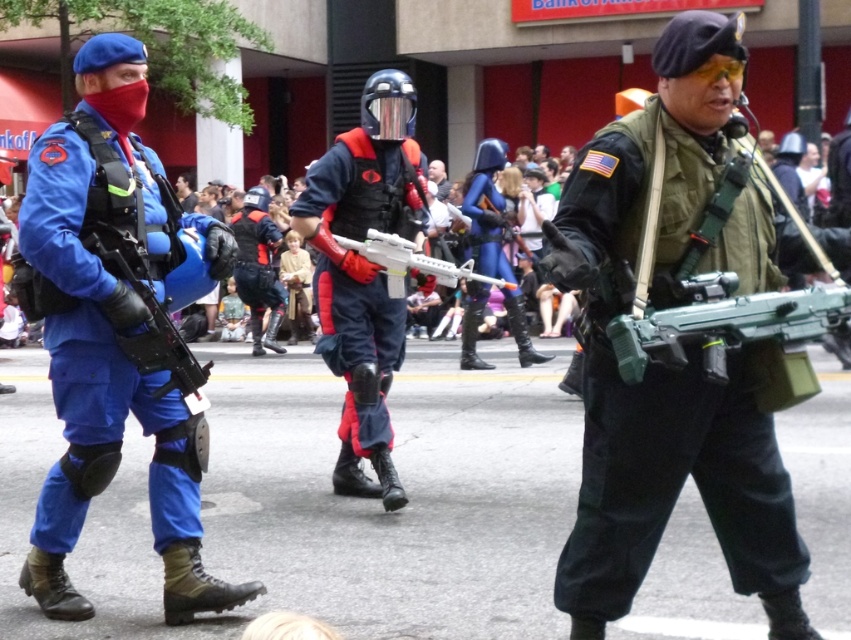
Is matte green vest at center positioned in front of green plastic toy gun at center?

That is False.

Measure the distance between matte green vest at center and camera.

They are 2.78 meters apart.

Where is `matte green vest at center`? The height and width of the screenshot is (640, 851). matte green vest at center is located at coordinates (684, 348).

Can you confirm if matte blue uniform at left is wider than green plastic toy gun at center?

Yes, matte blue uniform at left is wider than green plastic toy gun at center.

Does matte blue uniform at left have a lesser height compared to green plastic toy gun at center?

No.

This screenshot has height=640, width=851. I want to click on matte blue uniform at left, so click(x=118, y=330).

Locate an element on the screen. This screenshot has height=640, width=851. matte blue uniform at left is located at coordinates point(118,330).

Which is more to the right, matte blue uniform at left or white plastic toy gun at center?

white plastic toy gun at center is more to the right.

Does matte blue uniform at left appear over white plastic toy gun at center?

No, matte blue uniform at left is not above white plastic toy gun at center.

The width and height of the screenshot is (851, 640). What are the coordinates of `matte blue uniform at left` in the screenshot? It's located at (118, 330).

Find the location of a particular element. The width and height of the screenshot is (851, 640). matte blue uniform at left is located at coordinates (118, 330).